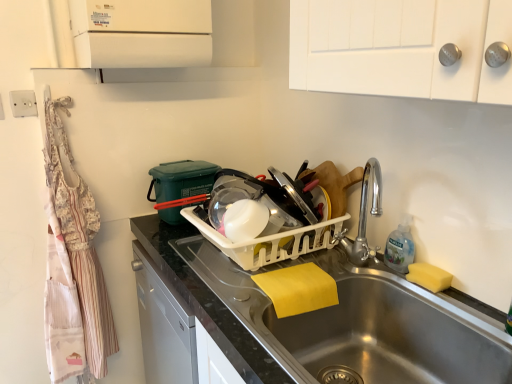
Question: Does point (262, 236) appear closer or farther from the camera than point (393, 264)?

Choices:
 (A) closer
 (B) farther

Answer: (A)

Question: Considering their positions, is white plastic dish rack at center located in front of or behind clear plastic bottle at sink right?

Choices:
 (A) front
 (B) behind

Answer: (A)

Question: Considering the real-world distances, which object is farthest from the yellow sponge at sink right?

Choices:
 (A) white plastic dish rack at center
 (B) white glossy counter top at center
 (C) clear plastic bottle at sink right
 (D) white floral apron at left
 (E) stainless steel sink at lower center

Answer: (D)

Question: Based on their relative distances, which object is nearer to the white glossy counter top at center?

Choices:
 (A) white plastic dish rack at center
 (B) white floral apron at left
 (C) yellow sponge at sink right
 (D) clear plastic bottle at sink right
 (E) stainless steel sink at lower center

Answer: (A)